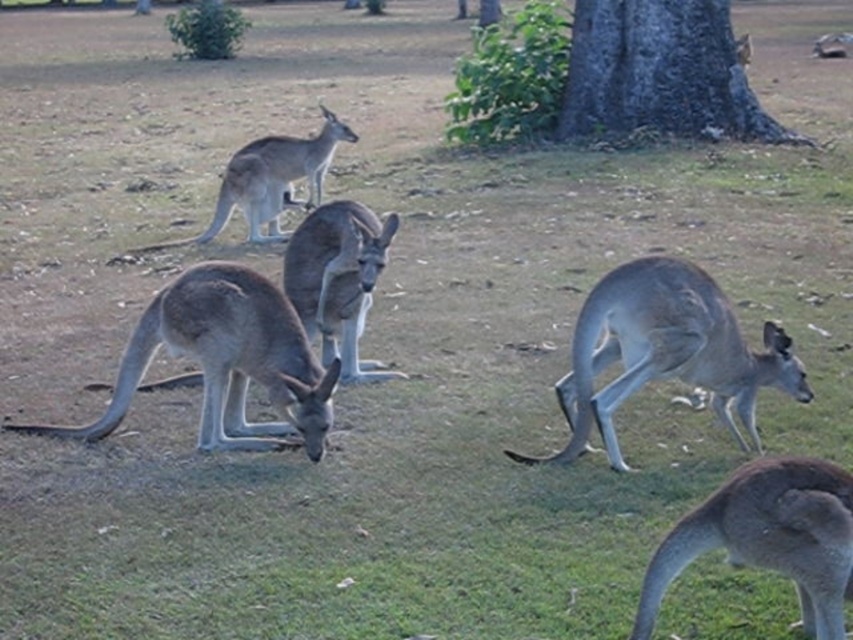
You are a wildlife photographer aiming to capture a photo of the gray matte kangaroo at lower left and brown fur at lower right together in the frame. Based on their positions, which kangaroo should you position your camera closer to in order to include both in the shot without zooming?

The gray matte kangaroo at lower left is to the left of brown fur at lower right. To include both in the shot without zooming, position the camera closer to the gray matte kangaroo at lower left so that the brown fur at lower right is within the same frame.

You are a wildlife photographer aiming to capture a photo of the gray matte kangaroo at center and the brown fur at lower right. Which kangaroo should you focus on first if you want to photograph the taller one?

The gray matte kangaroo at center is much taller than the brown fur at lower right, so you should focus on the gray matte kangaroo at center first to photograph the taller one.

You are a photographer trying to capture a closeup of the gray matte kangaroo at lower left and the brown fur at lower right. Which kangaroo should you focus on first to ensure it appears sharp in your photo?

You should focus on the gray matte kangaroo at lower left first because it is closer to you than the brown fur at lower right, so capturing it sharply will ensure proper focus.